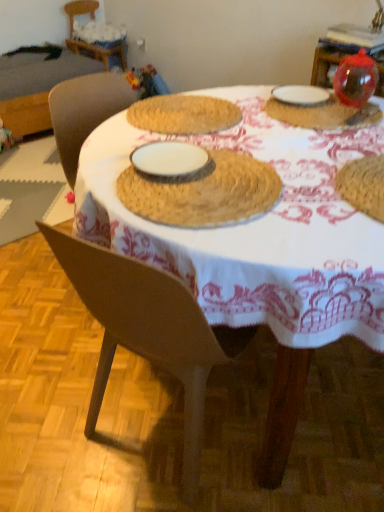
Where is `vacant area that is in front of white ceramic plate at upper right, the first tableware viewed from the left`? vacant area that is in front of white ceramic plate at upper right, the first tableware viewed from the left is located at coordinates (316, 119).